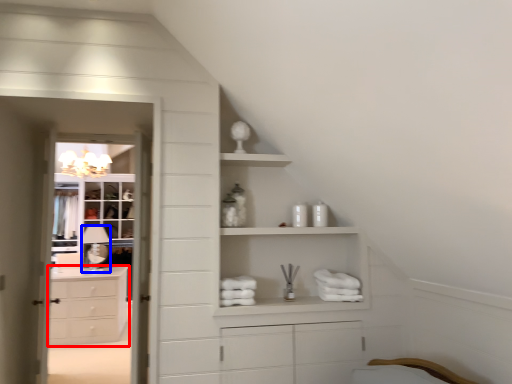
Question: Among these objects, which one is farthest to the camera, chest of drawers (highlighted by a red box) or lamp (highlighted by a blue box)?

Choices:
 (A) chest of drawers
 (B) lamp

Answer: (B)